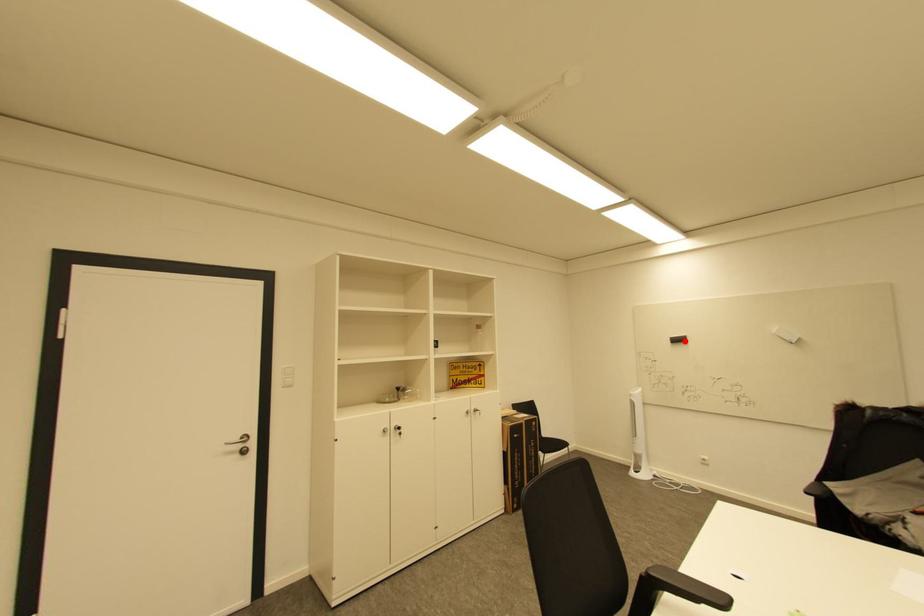
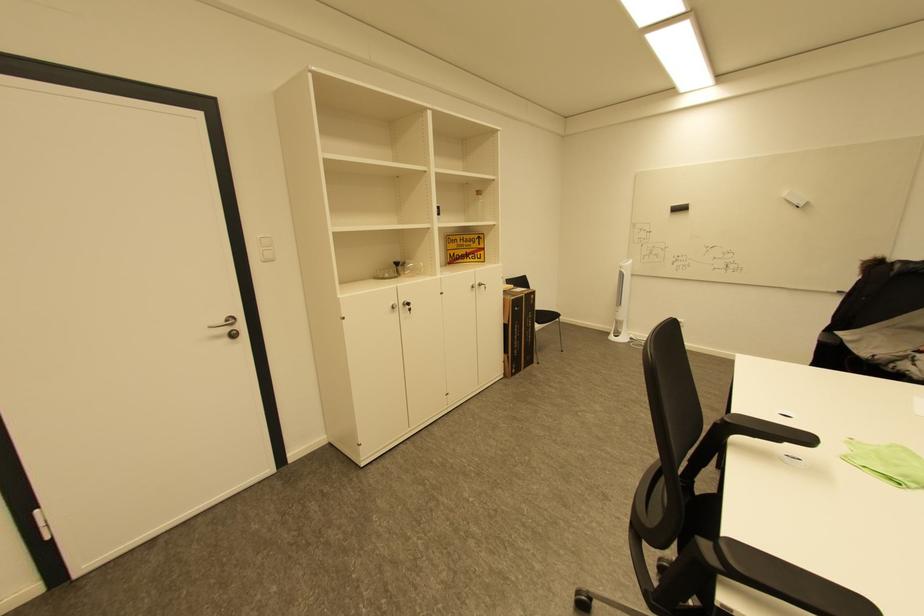
Where in the second image is the point corresponding to the highlighted location from the first image?

(686, 209)